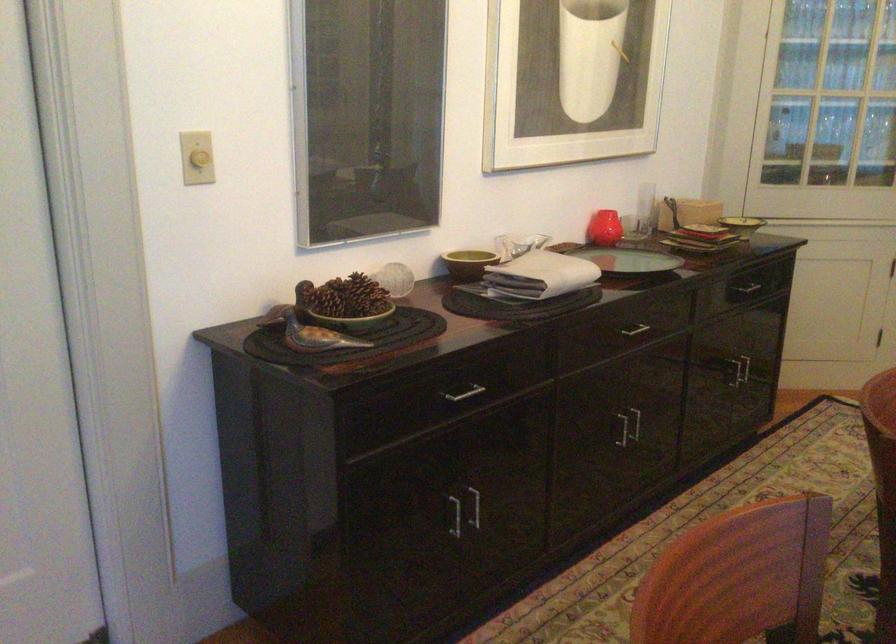
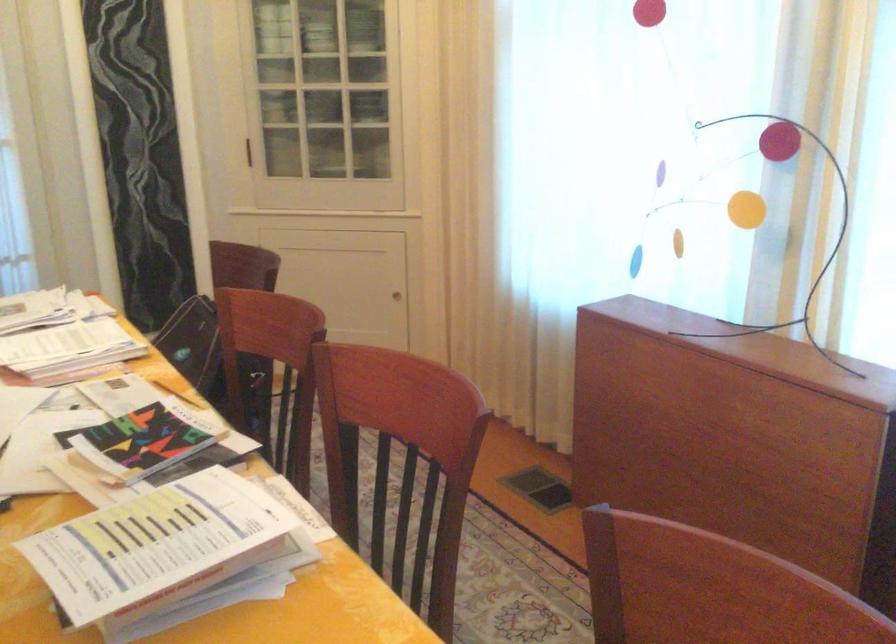
Question: The images are taken continuously from a first-person perspective. In which direction is your viewpoint rotating?

Choices:
 (A) Left
 (B) Right
 (C) Up
 (D) Down

Answer: (B)